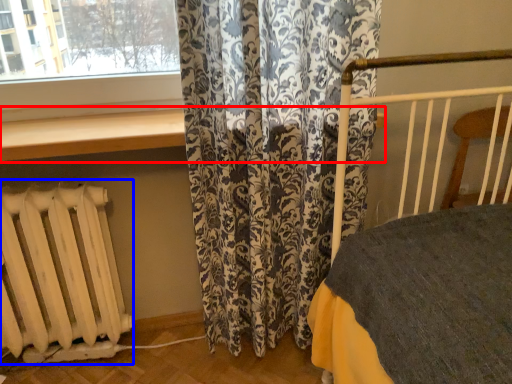
Question: Which object is further to the camera taking this photo, window sill (highlighted by a red box) or radiator (highlighted by a blue box)?

Choices:
 (A) window sill
 (B) radiator

Answer: (B)